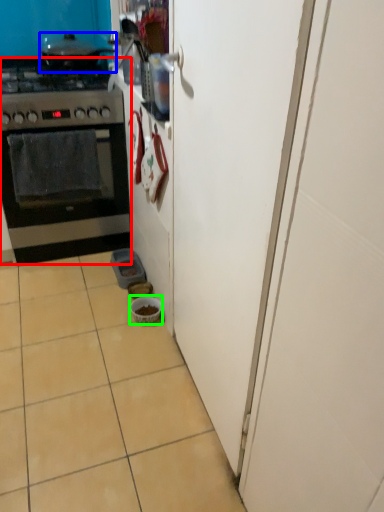
Question: Which is nearer to the kitchen appliance (highlighted by a red box)? open (highlighted by a blue box) or bowl (highlighted by a green box).

Choices:
 (A) open
 (B) bowl

Answer: (A)